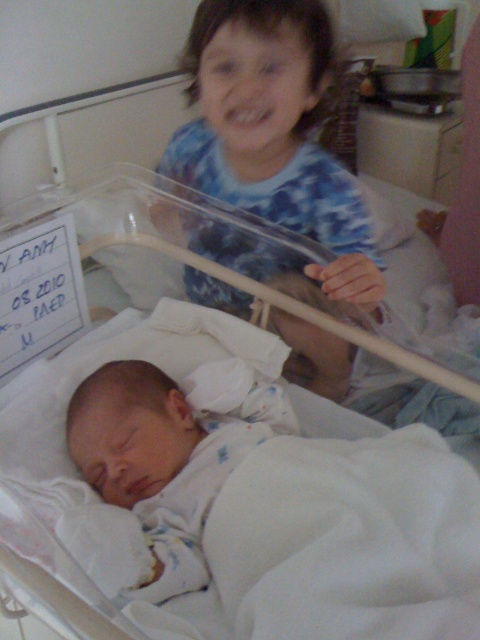
Question: Among these points, which one is farthest from the camera?

Choices:
 (A) (145, 497)
 (B) (305, 499)

Answer: (A)

Question: Does white fabric infant bed at center appear under white soft newborn at center?

Choices:
 (A) no
 (B) yes

Answer: (A)

Question: Estimate the real-world distances between objects in this image. Which object is farther from the blue tie-dye shirt at upper center?

Choices:
 (A) white fabric infant bed at center
 (B) white soft newborn at center

Answer: (B)

Question: Among these objects, which one is farthest from the camera?

Choices:
 (A) blue tie-dye shirt at upper center
 (B) white fabric infant bed at center
 (C) white soft newborn at center

Answer: (A)

Question: Is white fabric infant bed at center wider than blue tie-dye shirt at upper center?

Choices:
 (A) yes
 (B) no

Answer: (A)

Question: Where is white fabric infant bed at center located in relation to white soft newborn at center in the image?

Choices:
 (A) left
 (B) right

Answer: (A)